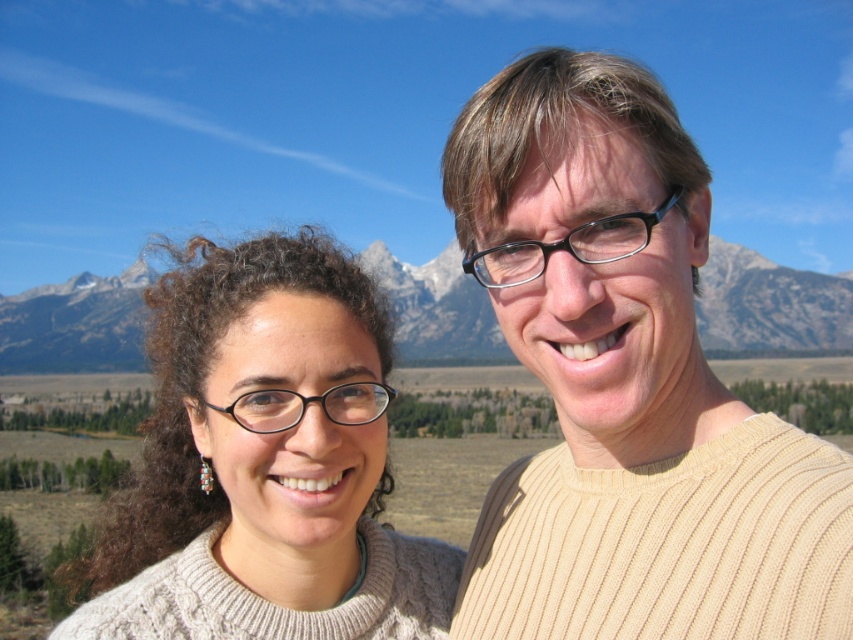
You are a photographer trying to capture a portrait of the two people in the scene. You want to ensure that the knitted sweater at center is perfectly centered in the frame. Given its 2D coordinates, what adjustments should you make to the camera position or framing?

The knitted sweater at center is located at coordinates 0.723 on the x and 0.312 on the y axis. To center it, adjust the camera to move the frame so that the sweater is positioned at the center point of the image, which would require shifting the camera slightly to the left and upwards.

You are a photographer planning to take a portrait of the two people in the scene. The knitted sweater at center and the snowy granite mountain at center are both in the frame. Which object is closer to the camera?

The knitted sweater at center is closer to the camera because it is in front of the snowy granite mountain at center.